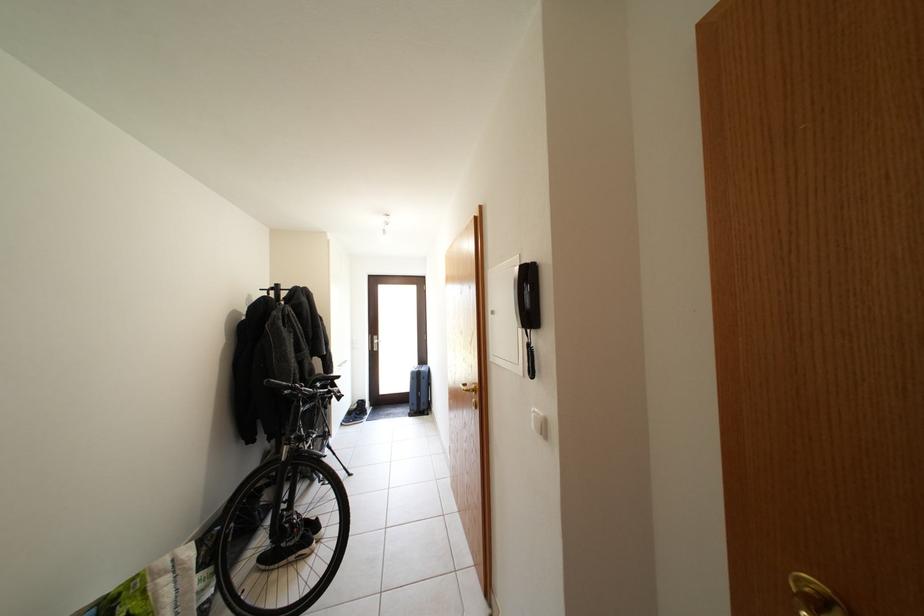
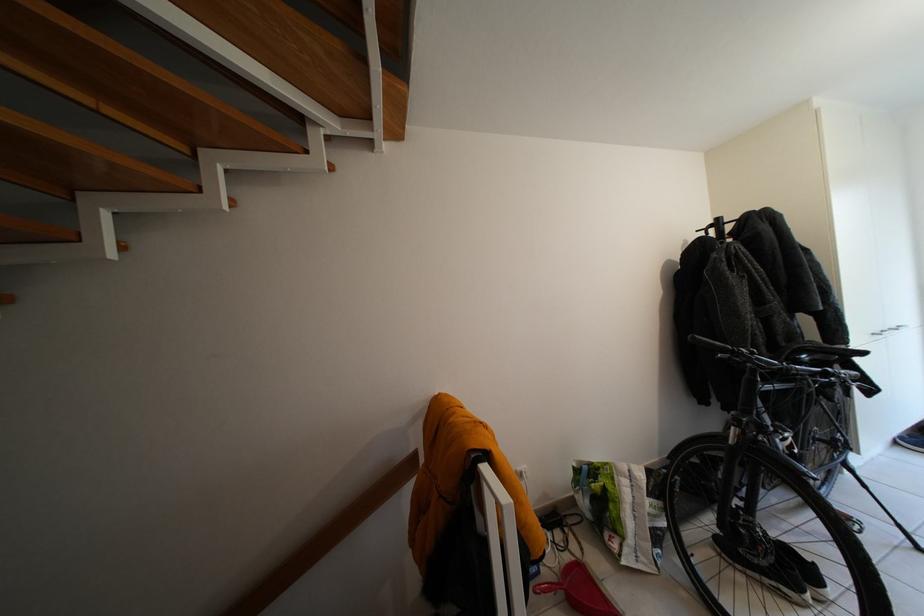
Find the pixel in the second image that matches point 338,386 in the first image.

(846, 361)